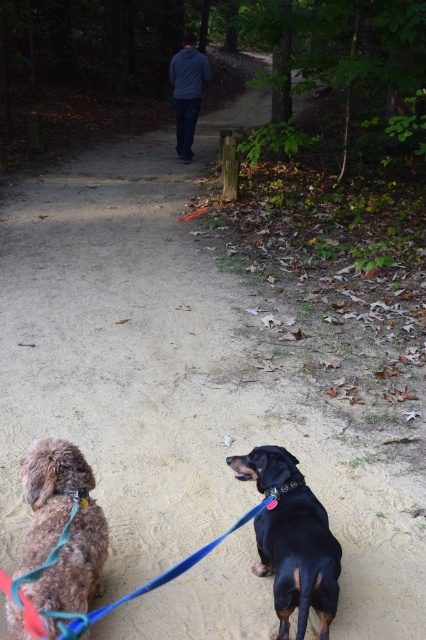
Question: Can you confirm if blue fabric leash at lower center is thinner than matte brown leather collar at lower left?

Choices:
 (A) no
 (B) yes

Answer: (A)

Question: Does brown fuzzy dog at lower left appear under black smooth dog at lower right?

Choices:
 (A) no
 (B) yes

Answer: (A)

Question: Among these points, which one is nearest to the camera?

Choices:
 (A) (46, 616)
 (B) (184, 72)
 (C) (273, 492)

Answer: (A)

Question: Which object appears closest to the camera in this image?

Choices:
 (A) brown fuzzy dog at lower left
 (B) blue denim jacket at center
 (C) matte brown leather collar at lower left
 (D) black leather neckband at lower center

Answer: (A)

Question: Estimate the real-world distances between objects in this image. Which object is farther from the blue denim jacket at center?

Choices:
 (A) black smooth dog at lower right
 (B) black leather neckband at lower center
 (C) brown fuzzy dog at lower left

Answer: (C)

Question: Can you confirm if brown fuzzy dog at lower left is positioned above black smooth dog at lower right?

Choices:
 (A) yes
 (B) no

Answer: (A)